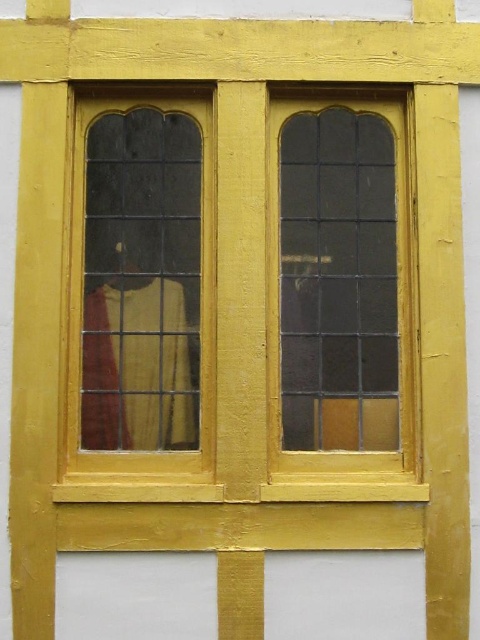
Measure the distance between stained glass window at center and camera.

stained glass window at center and camera are 5.90 meters apart from each other.

Between stained glass window at center and clear glass window at left, which one is positioned higher?

Positioned higher is stained glass window at center.

This screenshot has width=480, height=640. I want to click on stained glass window at center, so click(x=338, y=282).